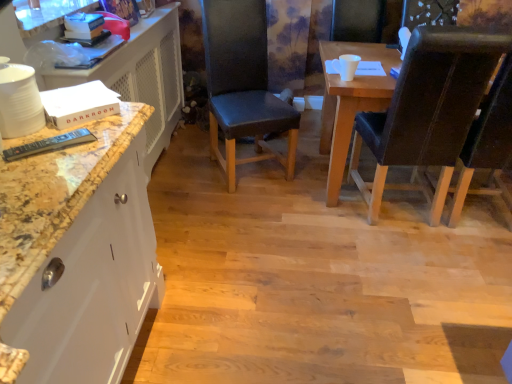
Question: Is black leather chair at center, the third chair from the right, touching marble/dark brown dresser at left?

Choices:
 (A) no
 (B) yes

Answer: (A)

Question: Does black leather chair at center, which is the 1th chair in left-to-right order, have a smaller size compared to marble/dark brown dresser at left?

Choices:
 (A) yes
 (B) no

Answer: (A)

Question: Is black leather chair at center, the third chair from the right, taller than marble/dark brown dresser at left?

Choices:
 (A) yes
 (B) no

Answer: (A)

Question: Considering the relative sizes of black leather chair at center, which is the 1th chair in left-to-right order, and marble/dark brown dresser at left in the image provided, is black leather chair at center, which is the 1th chair in left-to-right order, bigger than marble/dark brown dresser at left?

Choices:
 (A) no
 (B) yes

Answer: (A)

Question: From a real-world perspective, is black leather chair at center, which is the 1th chair in left-to-right order, positioned over marble/dark brown dresser at left based on gravity?

Choices:
 (A) yes
 (B) no

Answer: (A)

Question: Is black leather chair at center, the third chair from the right, looking in the opposite direction of marble/dark brown dresser at left?

Choices:
 (A) yes
 (B) no

Answer: (B)

Question: Is dark brown leather chair at right, arranged as the 3th chair when viewed from the left, further to the viewer compared to black leather chair at right, the 2th chair viewed from the left?

Choices:
 (A) no
 (B) yes

Answer: (A)

Question: Considering the relative sizes of dark brown leather chair at right, arranged as the 3th chair when viewed from the left, and black leather chair at right, the 2th chair viewed from the left, in the image provided, is dark brown leather chair at right, arranged as the 3th chair when viewed from the left, taller than black leather chair at right, the 2th chair viewed from the left,?

Choices:
 (A) no
 (B) yes

Answer: (A)

Question: Does dark brown leather chair at right, placed as the 1th chair when sorted from right to left, come in front of black leather chair at right, which is the second chair in right-to-left order?

Choices:
 (A) yes
 (B) no

Answer: (A)

Question: Does dark brown leather chair at right, arranged as the 3th chair when viewed from the left, touch black leather chair at right, the 2th chair viewed from the left?

Choices:
 (A) yes
 (B) no

Answer: (B)

Question: Is dark brown leather chair at right, placed as the 1th chair when sorted from right to left, at the right side of black leather chair at right, the 2th chair viewed from the left?

Choices:
 (A) no
 (B) yes

Answer: (B)

Question: Is dark brown leather chair at right, arranged as the 3th chair when viewed from the left, not within black leather chair at right, which is the second chair in right-to-left order?

Choices:
 (A) no
 (B) yes

Answer: (B)

Question: Considering the relative sizes of black leather chair at right, the 2th chair viewed from the left, and marble/dark brown dresser at left in the image provided, is black leather chair at right, the 2th chair viewed from the left, bigger than marble/dark brown dresser at left?

Choices:
 (A) yes
 (B) no

Answer: (B)